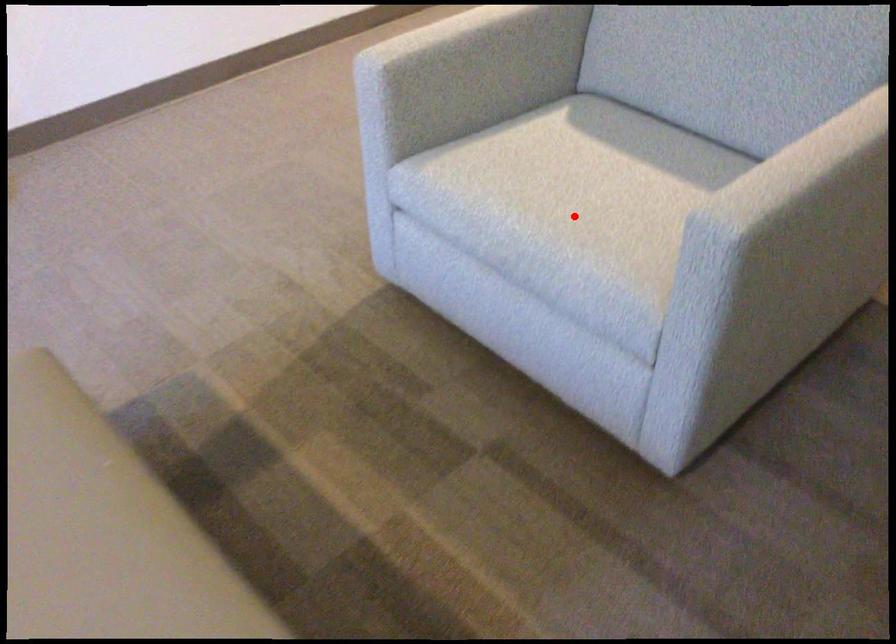
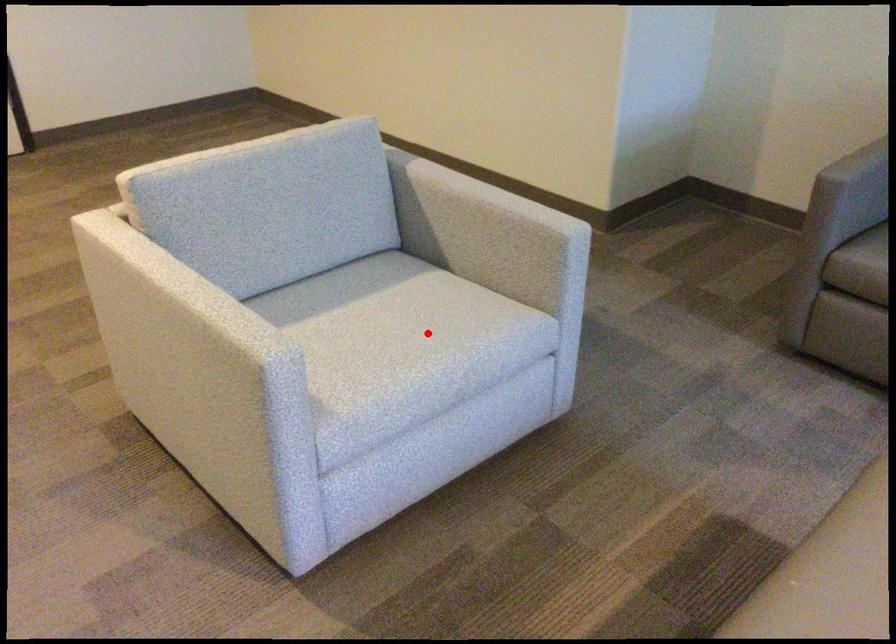
I am providing you with two images of the same scene from different viewpoints. A red point is marked on the first image and another point is marked on the second image. Are the points marked in image1 and image2 representing the same 3D position?

Yes